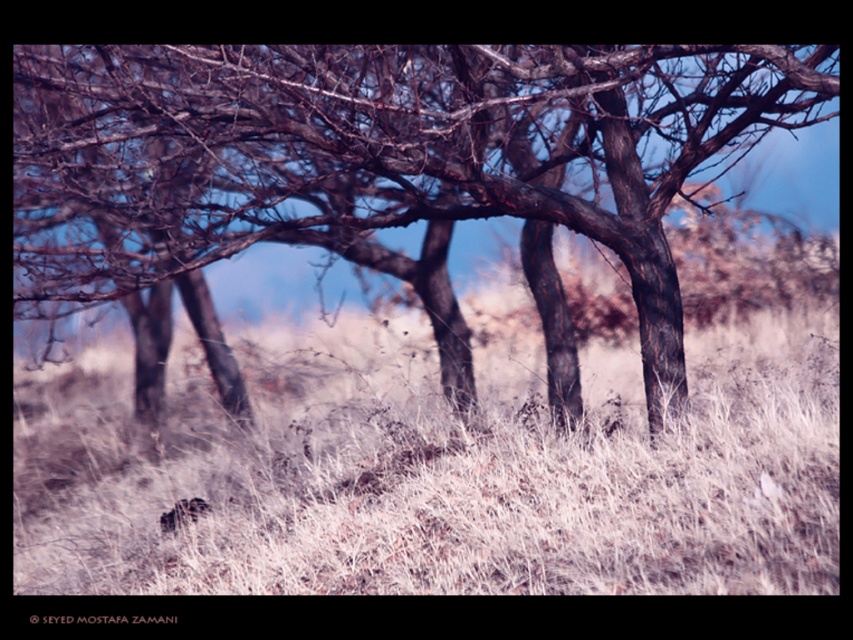
In the scene shown: You are standing at the point marked by the coordinates point [450,483] in the image. What is the immediate surface you are standing on?

The immediate surface at point [450,483] is dry grass at center, as indicated by the coordinates.

You are a gardener trying to maintain a balanced landscape. You notice the dry grass at center and brown bark tree at center. Which one has a wider spread in terms of horizontal coverage?

The brown bark tree at center has a wider spread than the dry grass at center since the dry grass at center is narrower in width according to the description.